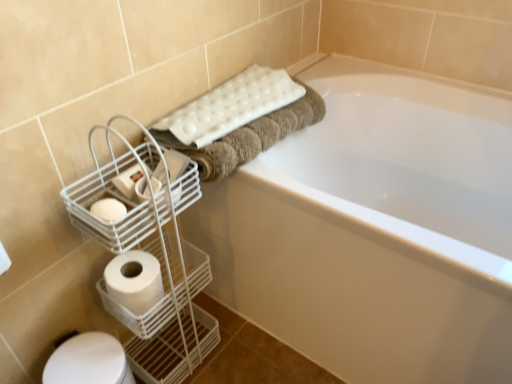
Question: Considering the relative positions of white wire basket at left and white glossy bathtub at upper center in the image provided, is white wire basket at left to the left or to the right of white glossy bathtub at upper center?

Choices:
 (A) right
 (B) left

Answer: (B)

Question: Would you say white wire basket at left is inside or outside white glossy bathtub at upper center?

Choices:
 (A) outside
 (B) inside

Answer: (A)

Question: Which object is positioned closest to the white textured bath towel at upper center?

Choices:
 (A) white wire basket at left
 (B) white glossy bathtub at upper center
 (C) white matte toilet paper at left, acting as the second toilet paper starting from the bottom
 (D) white matte toilet paper at lower left, the first toilet paper ordered from the bottom

Answer: (A)

Question: Considering the real-world distances, which object is closest to the white matte toilet paper at lower left, the first toilet paper ordered from the bottom?

Choices:
 (A) white matte toilet paper at left, the 1th toilet paper from the top
 (B) white glossy bathtub at upper center
 (C) white wire basket at left
 (D) white textured bath towel at upper center

Answer: (C)